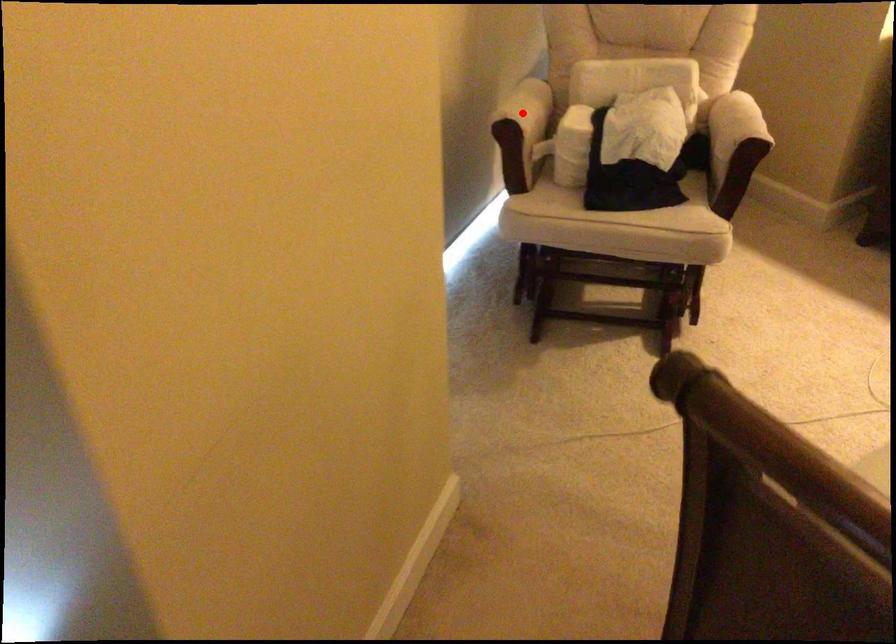
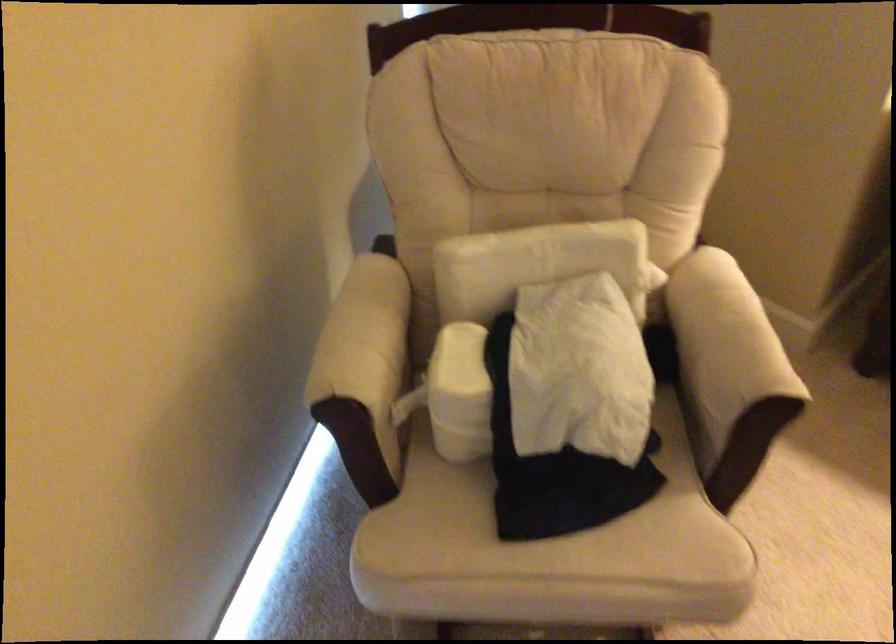
Locate, in the second image, the point that corresponds to the highlighted location in the first image.

(364, 373)